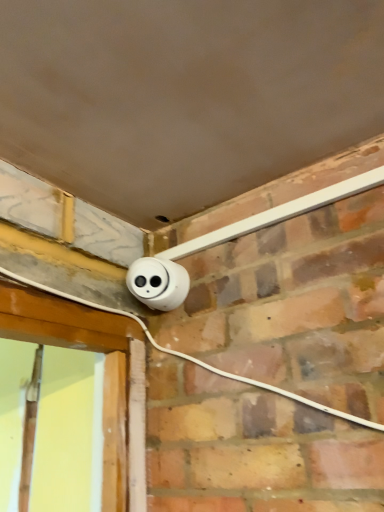
Measure the distance between white plastic power plugs and sockets at center and camera.

white plastic power plugs and sockets at center and camera are 83.53 centimeters apart from each other.

Describe the element at coordinates (158, 283) in the screenshot. This screenshot has height=512, width=384. I see `white plastic power plugs and sockets at center` at that location.

The width and height of the screenshot is (384, 512). I want to click on white plastic power plugs and sockets at center, so click(x=158, y=283).

Where is `white plastic power plugs and sockets at center`? The width and height of the screenshot is (384, 512). white plastic power plugs and sockets at center is located at coordinates (158, 283).